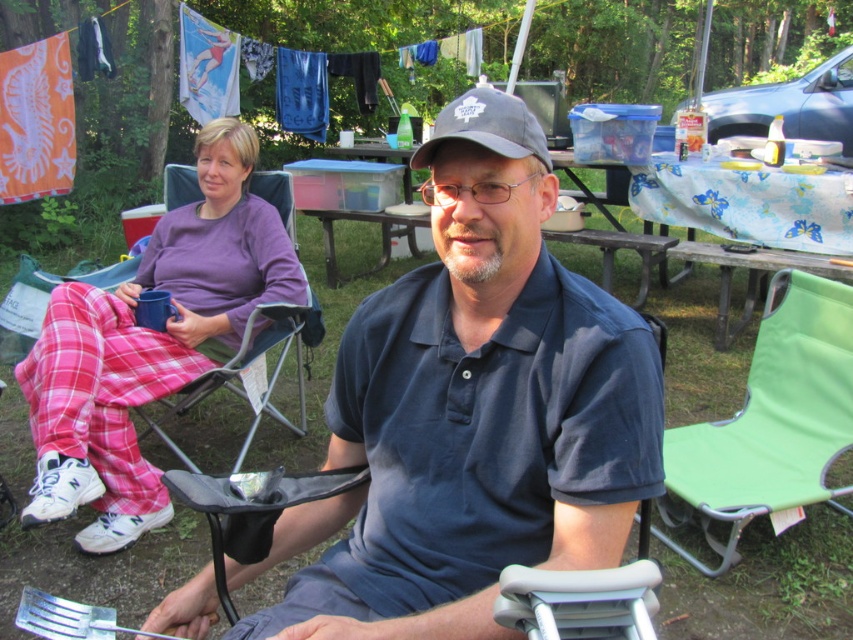
Is pink plaid pants at left closer to camera compared to gray fabric baseball cap at center?

No.

Does pink plaid pants at left appear on the right side of gray fabric baseball cap at center?

No, pink plaid pants at left is not to the right of gray fabric baseball cap at center.

Between point (195, 371) and point (469, 100), which one is positioned behind?

Point (195, 371)

Where is `pink plaid pants at left`? pink plaid pants at left is located at coordinates (149, 344).

How much distance is there between green fabric folding chair at lower right and gray fabric baseball cap at center?

A distance of 4.70 feet exists between green fabric folding chair at lower right and gray fabric baseball cap at center.

Is green fabric folding chair at lower right taller than gray fabric baseball cap at center?

Indeed, green fabric folding chair at lower right has a greater height compared to gray fabric baseball cap at center.

Is point (804, 285) behind point (469, 109)?

That is True.

Where is `green fabric folding chair at lower right`? The height and width of the screenshot is (640, 853). green fabric folding chair at lower right is located at coordinates (770, 420).

Locate an element on the screen. The width and height of the screenshot is (853, 640). dark blue cotton polo shirt at center is located at coordinates (471, 426).

Is point (563, 346) less distant than point (717, 324)?

Yes.

This screenshot has height=640, width=853. Find the location of `dark blue cotton polo shirt at center`. dark blue cotton polo shirt at center is located at coordinates (471, 426).